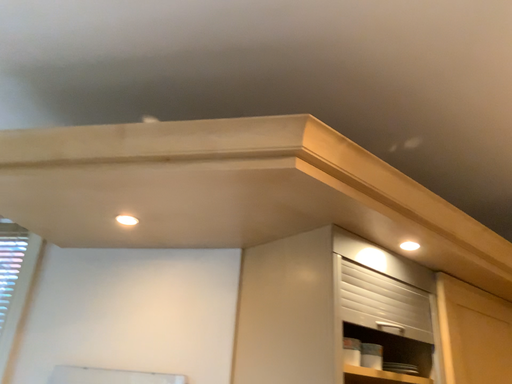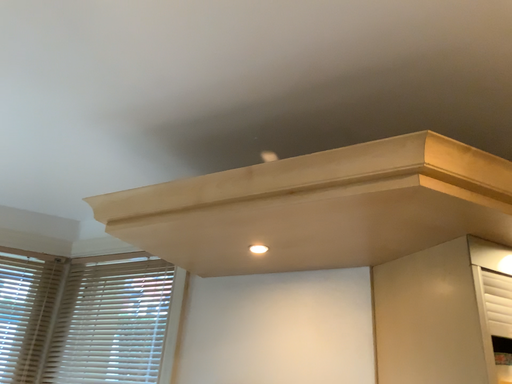
Question: Which way did the camera rotate in the video?

Choices:
 (A) rotated left
 (B) rotated right

Answer: (A)